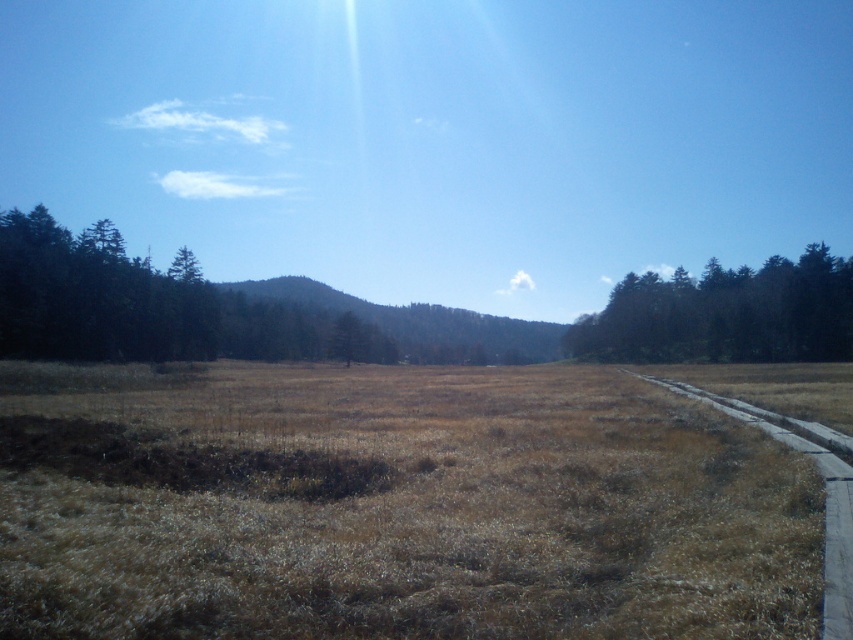
Question: Is dark green textured trees at left to the left of green matte tree at right from the viewer's perspective?

Choices:
 (A) no
 (B) yes

Answer: (B)

Question: Can you confirm if brown dry grass at center is wider than green matte tree at right?

Choices:
 (A) yes
 (B) no

Answer: (B)

Question: Which point is farther to the camera?

Choices:
 (A) (747, 298)
 (B) (619, 472)

Answer: (A)

Question: Is brown dry grass at center in front of green matte tree at right?

Choices:
 (A) no
 (B) yes

Answer: (B)

Question: Which object is the farthest from the dark green textured trees at left?

Choices:
 (A) brown dry grass at center
 (B) gray concrete path at right
 (C) green matte tree at right

Answer: (C)

Question: Which of the following is the farthest from the observer?

Choices:
 (A) dark green textured trees at left
 (B) brown dry grass at center
 (C) green matte tree at right

Answer: (C)